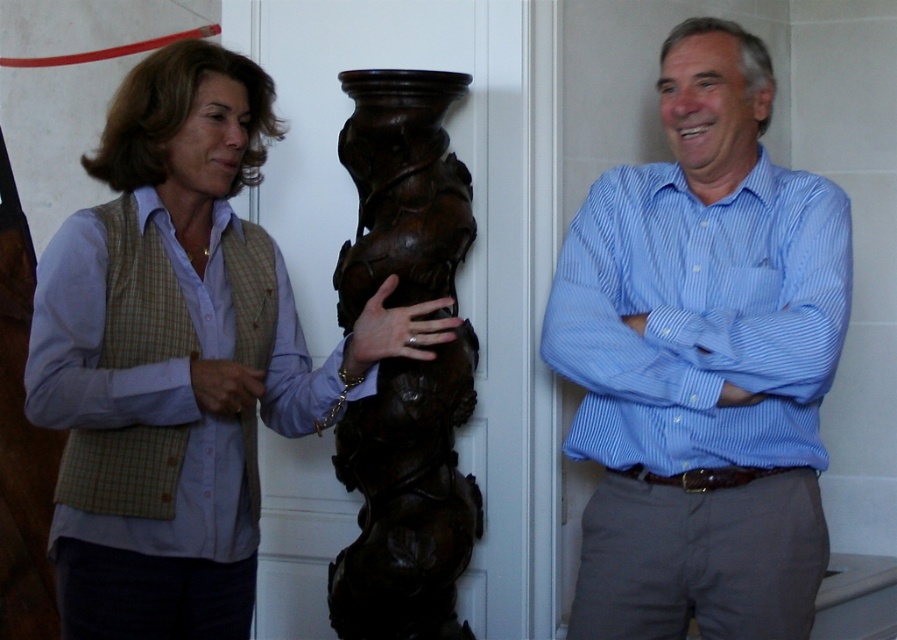
You are a photographer trying to capture a portrait of both the blue striped shirt at center and the woman in light purple button up shirt. The minimum distance required for your camera to focus on both subjects clearly is 7 feet. Will you be able to take the photo without moving either subject?

The subjects are 6.96 feet apart, which is less than the 7 feet minimum required for the camera to focus both clearly. Therefore, you will not be able to take the photo without moving them closer together or farther apart to meet the distance requirement.

Based on the photo, you are a photographer setting up a shoot in this scene. You need to ensure the blue striped shirt at center and the brown polished wood column at center are both visible in the frame. Given their sizes, which object should you prioritize keeping closer to the camera to maintain detail in both?

The blue striped shirt at center is larger in size than the brown polished wood column at center, so you should prioritize keeping the brown polished wood column at center closer to the camera to ensure both are visible with sufficient detail.